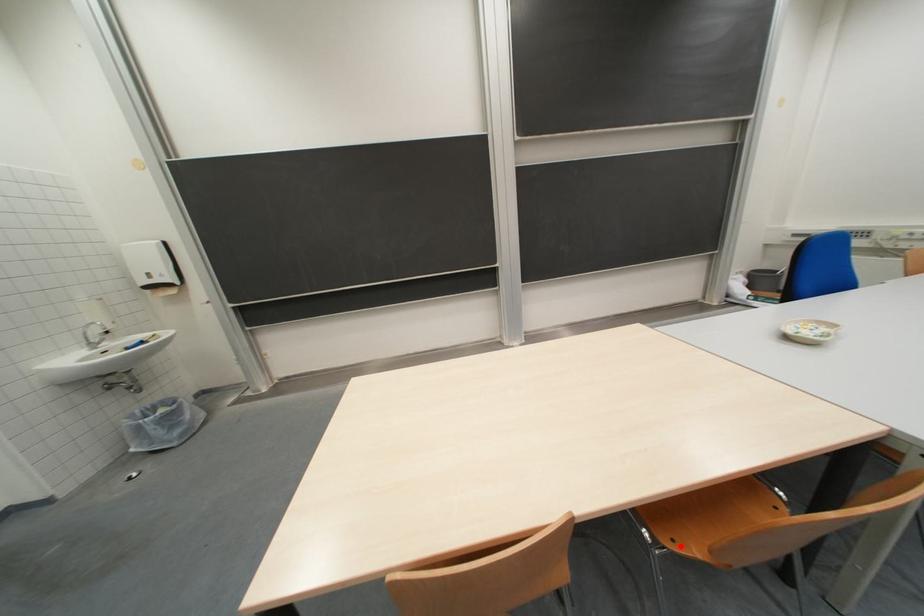
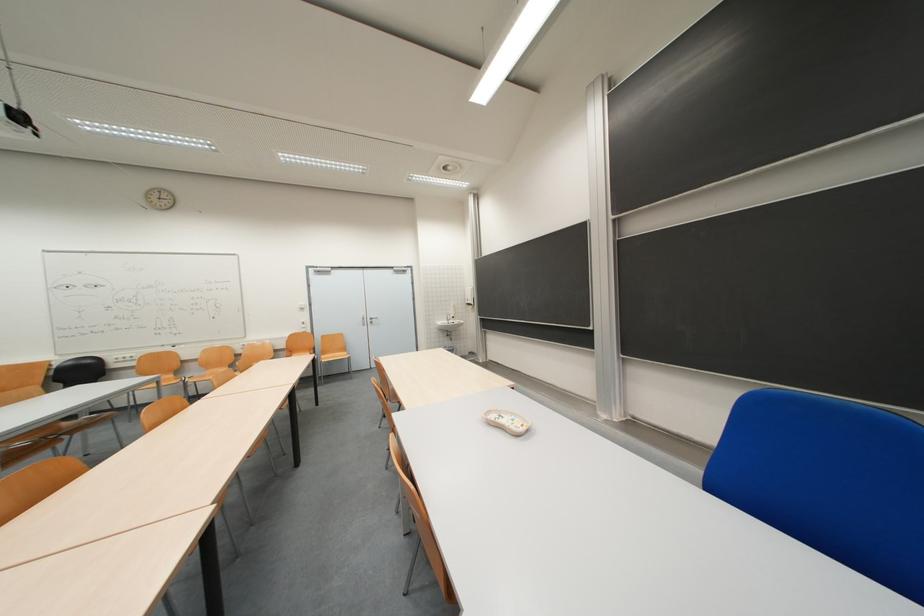
Question: I am providing you with two images of the same scene from different viewpoints. A red point is marked on the first image. Can you still see the location of the red point in image 2?

Choices:
 (A) Yes
 (B) No

Answer: (B)